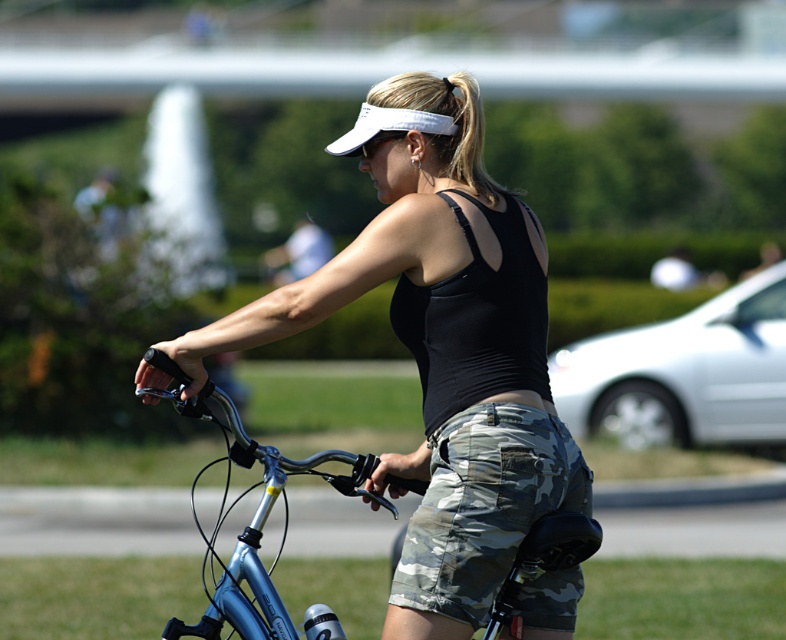
Question: Which object is the farthest from the black matte tank top at center?

Choices:
 (A) camo fabric shorts at center
 (B) white fabric visor at upper center

Answer: (B)

Question: Which point appears closest to the camera in this image?

Choices:
 (A) (417, 525)
 (B) (410, 300)

Answer: (A)

Question: Is black matte tank top at center positioned before metallic blue bicycle at center?

Choices:
 (A) yes
 (B) no

Answer: (A)

Question: Is camo fabric shorts at center thinner than white fabric visor at upper center?

Choices:
 (A) yes
 (B) no

Answer: (A)

Question: Is black matte tank top at center smaller than metallic blue bicycle at center?

Choices:
 (A) yes
 (B) no

Answer: (A)

Question: Among these points, which one is nearest to the camera?

Choices:
 (A) (461, 346)
 (B) (397, 618)

Answer: (B)